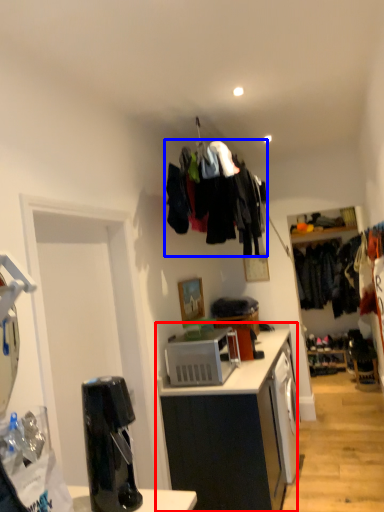
Question: Among these objects, which one is farthest to the camera, cabinetry (highlighted by a red box) or clothing (highlighted by a blue box)?

Choices:
 (A) cabinetry
 (B) clothing

Answer: (B)